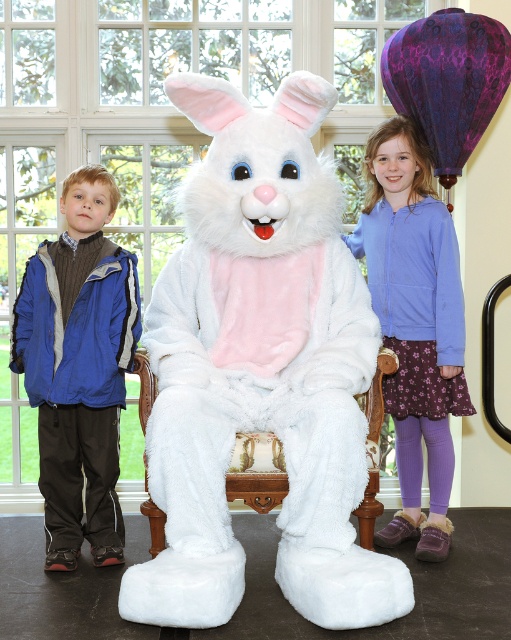
Question: Does blue fleece jacket at left have a greater width compared to white plush chair at center?

Choices:
 (A) yes
 (B) no

Answer: (A)

Question: Which of the following is the farthest from the observer?

Choices:
 (A) white plush chair at center
 (B) purple fleece jacket at upper right
 (C) fluffy white bunny at center
 (D) blue fleece jacket at left

Answer: (B)

Question: Estimate the real-world distances between objects in this image. Which object is closer to the fluffy white bunny at center?

Choices:
 (A) purple fleece jacket at upper right
 (B) white plush chair at center
 (C) blue fleece jacket at left

Answer: (B)

Question: Does fluffy white bunny at center have a greater width compared to blue fleece jacket at left?

Choices:
 (A) yes
 (B) no

Answer: (A)

Question: Which is nearer to the purple fleece jacket at upper right?

Choices:
 (A) blue fleece jacket at left
 (B) white plush chair at center

Answer: (B)

Question: Is purple fleece jacket at upper right bigger than white plush chair at center?

Choices:
 (A) yes
 (B) no

Answer: (A)